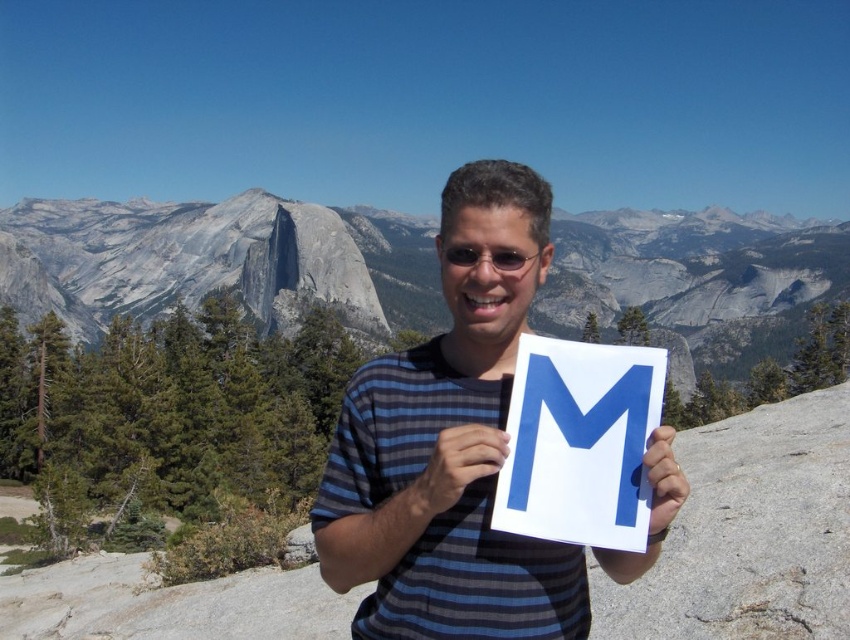
You are a photographer trying to capture the two points in the image. The first point is at coordinate point [672,228] and the second is at point [496,182]. Which point is closer to the camera?

Point [496,182] is closer to the camera because it is in front of point [672,228].

You are a photographer trying to capture the white paper at center and the matte plastic goggles at center in a single frame. Which object should you focus on first if you want to ensure both are in focus, considering their sizes?

Since the white paper at center is larger in size than the matte plastic goggles at center, you should focus on the white paper at center first to ensure both are in focus.

From the picture: You are a photographer trying to capture the blue paper letter m at center and the matte plastic goggles at center in the same frame. Which object should you focus on first if you want to ensure both are in focus?

The blue paper letter m at center is located below matte plastic plastic goggles at center. Since they are both at the center, you should focus on the matte plastic goggles at center first because it is closer to the camera, ensuring both will be in focus.